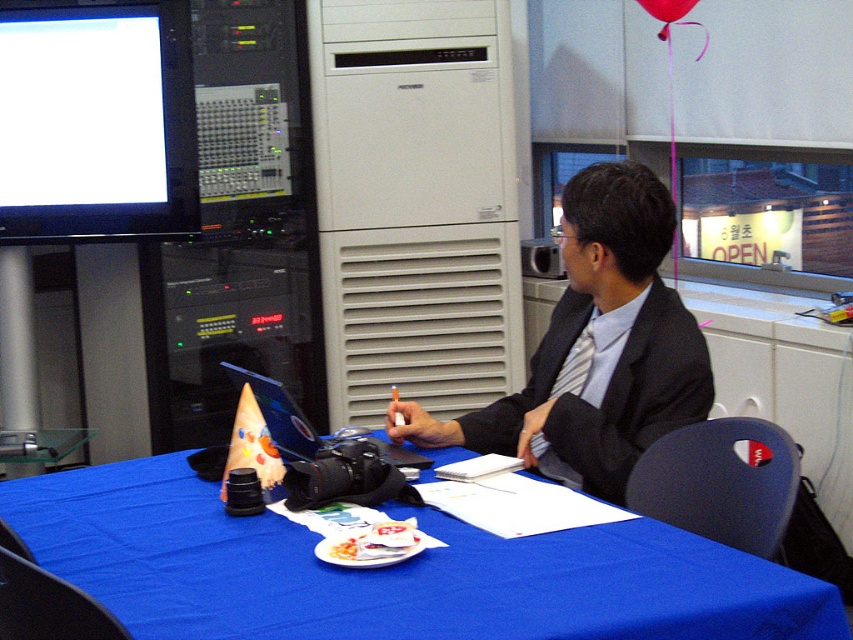
You are standing in the studio and want to place a new object at the location of point [676,406] and another object at point [679,10]. Which point is closer to the camera?

Point [676,406] is closer to the camera than point [679,10].

You are organizing a surprise party and need to decide which item to place on the table. The matte black suit at center and the red fabric balloon at upper center are both candidates. Which item takes up more space on the table?

The matte black suit at center is bigger than the red fabric balloon at upper center, so it takes up more space on the table.

You are organizing a birthday party setup in the studio. You need to place a blue plastic laptop at center and a red fabric balloon at upper center. According to the scene description, which object is taller?

The blue plastic laptop at center is taller than the red fabric balloon at upper center.